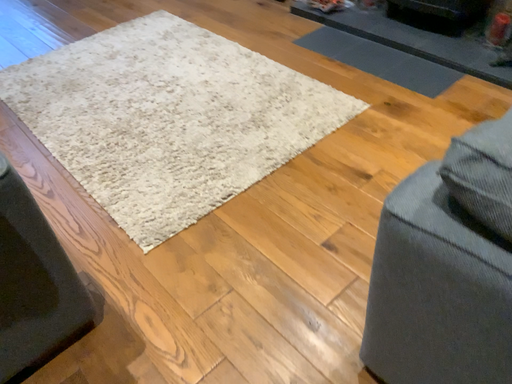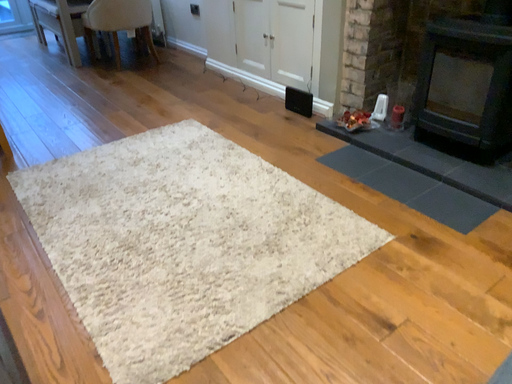
Question: Which way did the camera rotate in the video?

Choices:
 (A) rotated downward
 (B) rotated upward

Answer: (B)